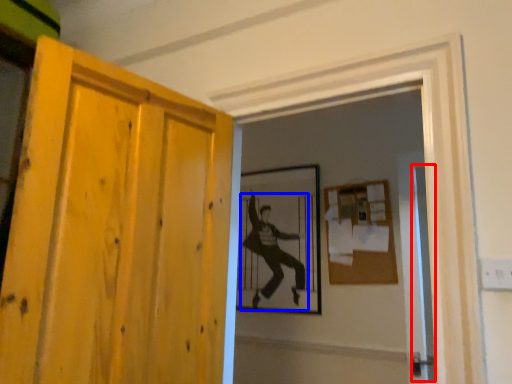
Question: Among these objects, which one is nearest to the camera, screen door (highlighted by a red box) or person (highlighted by a blue box)?

Choices:
 (A) screen door
 (B) person

Answer: (A)